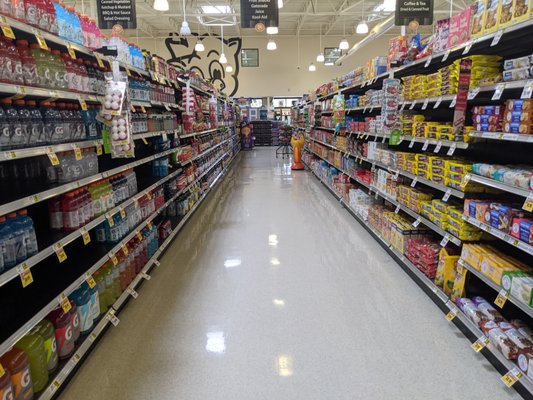
Where is `silver gray floor surface`? silver gray floor surface is located at coordinates (337, 303).